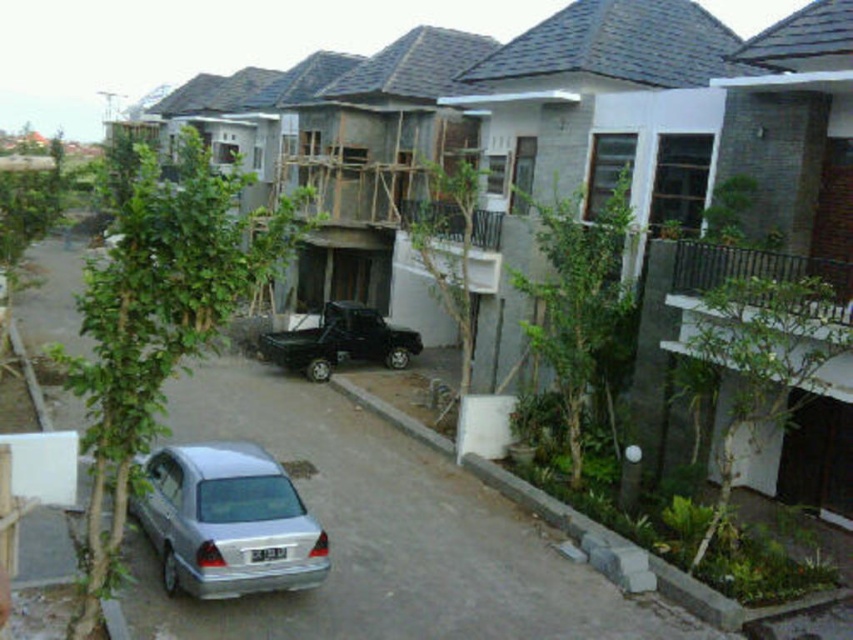
Consider the image. Which of these two, silver metallic car at lower left or black matte truck at center, stands taller?

black matte truck at center

At what (x,y) coordinates should I click in order to perform the action: click on silver metallic car at lower left. Please return your answer as a coordinate pair (x, y). Image resolution: width=853 pixels, height=640 pixels. Looking at the image, I should click on (228, 522).

Locate an element on the screen. The height and width of the screenshot is (640, 853). metallic silver car at center is located at coordinates (387, 536).

Find the location of a particular element. metallic silver car at center is located at coordinates (387, 536).

Which is above, metallic silver car at center or black matte truck at center?

black matte truck at center is higher up.

In the scene shown: Who is more distant from viewer, (329,509) or (346,304)?

The point (346,304) is more distant.

The height and width of the screenshot is (640, 853). What are the coordinates of `metallic silver car at center` in the screenshot? It's located at (387, 536).